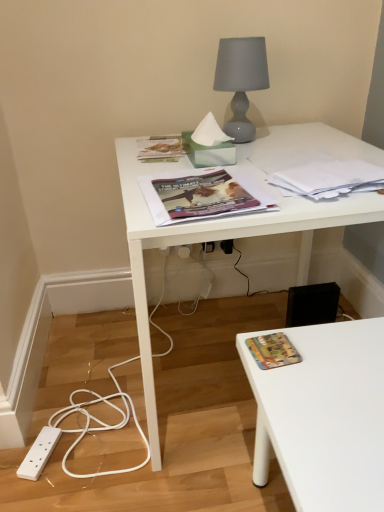
Where is `vacant space to the left of white glossy desk at upper center`? The image size is (384, 512). vacant space to the left of white glossy desk at upper center is located at coordinates (89, 388).